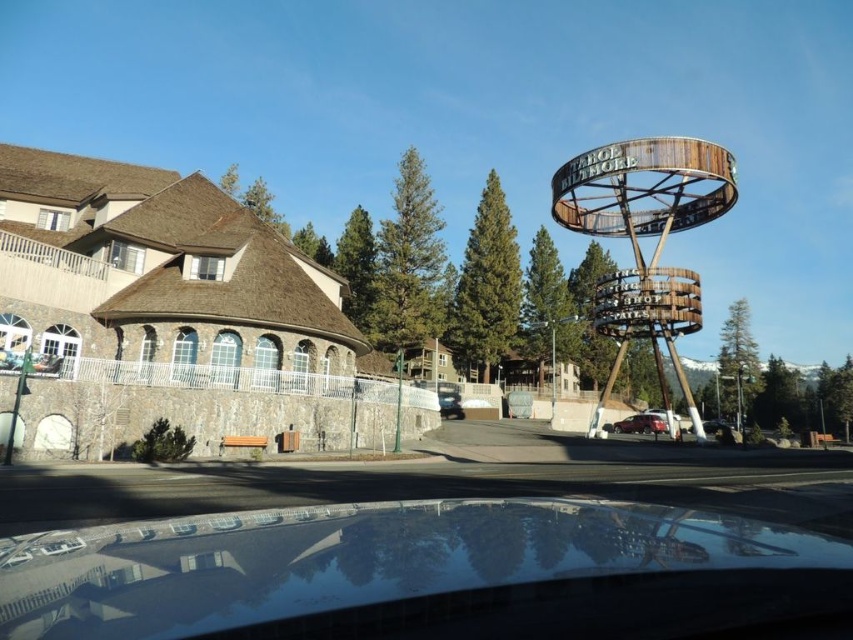
Is rustic wood sign at upper right wider than black glossy car at lower center?

No, rustic wood sign at upper right is not wider than black glossy car at lower center.

Is point (612, 152) farther from camera compared to point (724, 422)?

No.

Which is in front, point (595, 161) or point (712, 432)?

Point (595, 161) is in front.

Find the location of `rustic wood sign at upper right`. rustic wood sign at upper right is located at coordinates (645, 236).

Does metallic maroon car at center-right have a lesser width compared to black glossy car at lower center?

Indeed, metallic maroon car at center-right has a lesser width compared to black glossy car at lower center.

Is metallic maroon car at center-right further to the viewer compared to black glossy car at lower center?

Yes, metallic maroon car at center-right is behind black glossy car at lower center.

Which is behind, point (660, 428) or point (715, 429)?

Positioned behind is point (660, 428).

Locate an element on the screen. Image resolution: width=853 pixels, height=640 pixels. metallic maroon car at center-right is located at coordinates (641, 422).

Can you confirm if rustic wood sign at upper right is taller than metallic maroon car at center-right?

Yes, rustic wood sign at upper right is taller than metallic maroon car at center-right.

Does rustic wood sign at upper right appear over metallic maroon car at center-right?

Indeed, rustic wood sign at upper right is positioned over metallic maroon car at center-right.

Is point (613, 218) positioned behind point (648, 413)?

No.

You are a GUI agent. You are given a task and a screenshot of the screen. Output one action in this format:
    pyautogui.click(x=<x>, y=<y>)
    Task: Click on the rustic wood sign at upper right
    The image size is (853, 640).
    Given the screenshot: What is the action you would take?
    pyautogui.click(x=645, y=236)